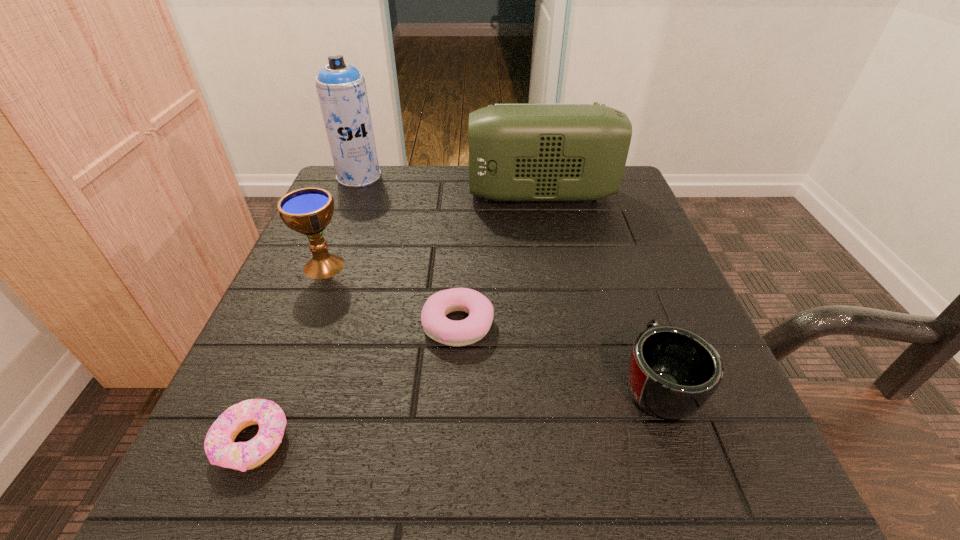
You are a GUI agent. You are given a task and a screenshot of the screen. Output one action in this format:
    pyautogui.click(x=<x>, y=<y>)
    Task: Click on the blank area at the left edge
    This screenshot has width=960, height=540.
    Given the screenshot: What is the action you would take?
    pyautogui.click(x=261, y=335)

Locate an element on the screen. vacant area at the right edge of the desktop is located at coordinates (617, 228).

In the image, there is a desktop. What are the coordinates of `vacant space at the far left corner` in the screenshot? It's located at (360, 189).

This screenshot has height=540, width=960. I want to click on vacant space at the near right corner, so click(x=769, y=475).

The image size is (960, 540). In order to click on free space between the second shortest object and the doughnut in this screenshot , I will do pos(355,383).

Identify the location of free space between the shortest object and the tallest object. (306, 308).

The height and width of the screenshot is (540, 960). Identify the location of free point between the third tallest object and the tallest object. (342, 221).

The image size is (960, 540). What are the coordinates of `free area in between the tallest object and the pastry` in the screenshot? It's located at (409, 251).

Where is `vacant space that's between the radio_receiver and the pastry`? The image size is (960, 540). vacant space that's between the radio_receiver and the pastry is located at coordinates (499, 260).

The width and height of the screenshot is (960, 540). I want to click on unoccupied position between the doughnut and the mug, so click(454, 413).